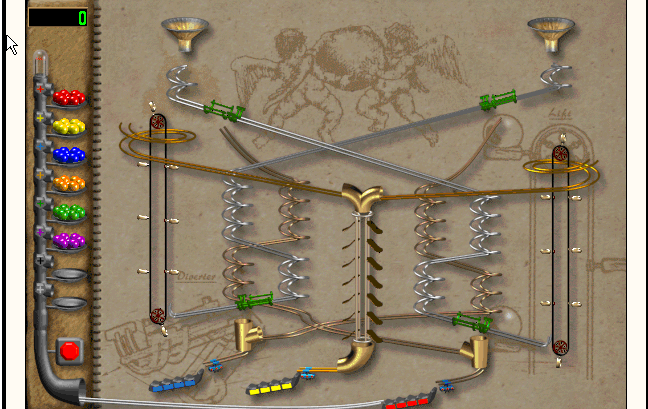
Locate an element on the screen. This screenshot has height=409, width=648. holder for white marbles is located at coordinates (67, 308).